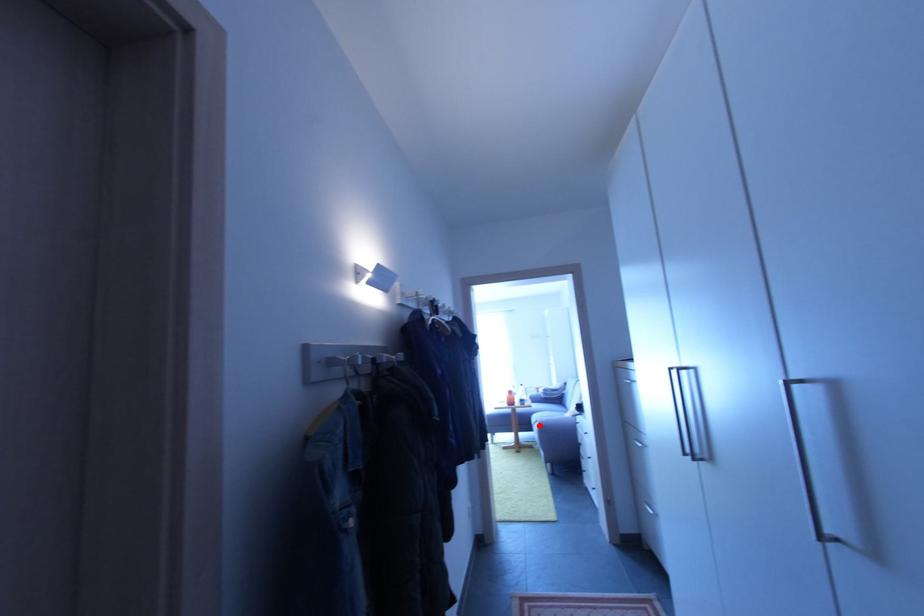
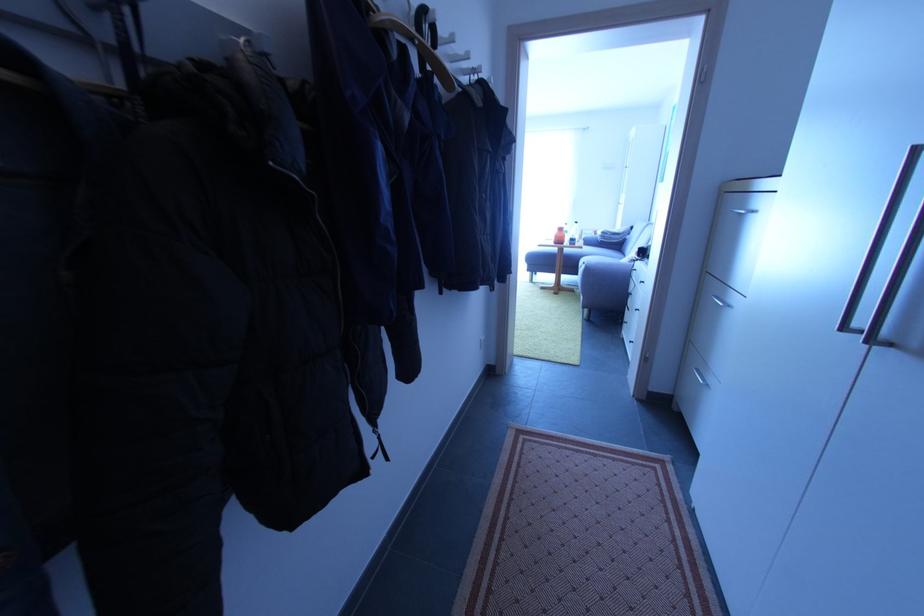
Question: I am providing you with two images of the same scene from different viewpoints. Image1 has a red point marked. In image2, the corresponding 3D location appears at what relative position? Reply with the corresponding letter.

Choices:
 (A) Closer
 (B) Farther

Answer: (A)